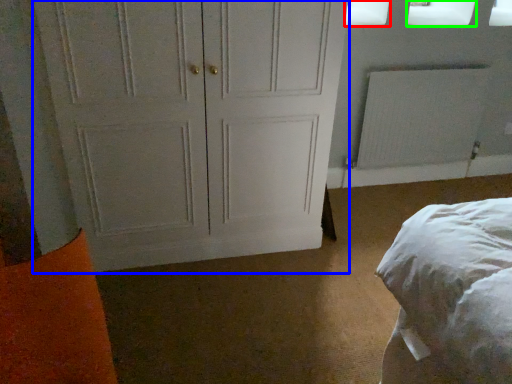
Question: Which is farther away from window screen (highlighted by a red box)? door (highlighted by a blue box) or window screen (highlighted by a green box)?

Choices:
 (A) door
 (B) window screen

Answer: (A)